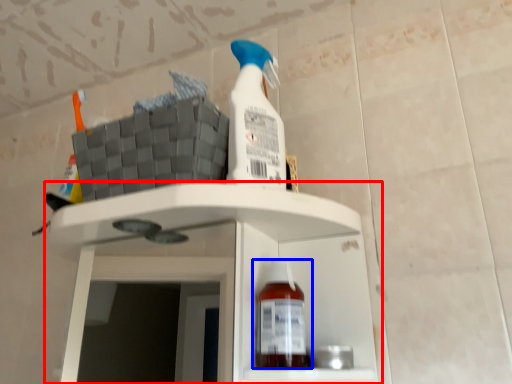
Question: Which object appears farthest to the camera in this image, shelf (highlighted by a red box) or bottle (highlighted by a blue box)?

Choices:
 (A) shelf
 (B) bottle

Answer: (B)